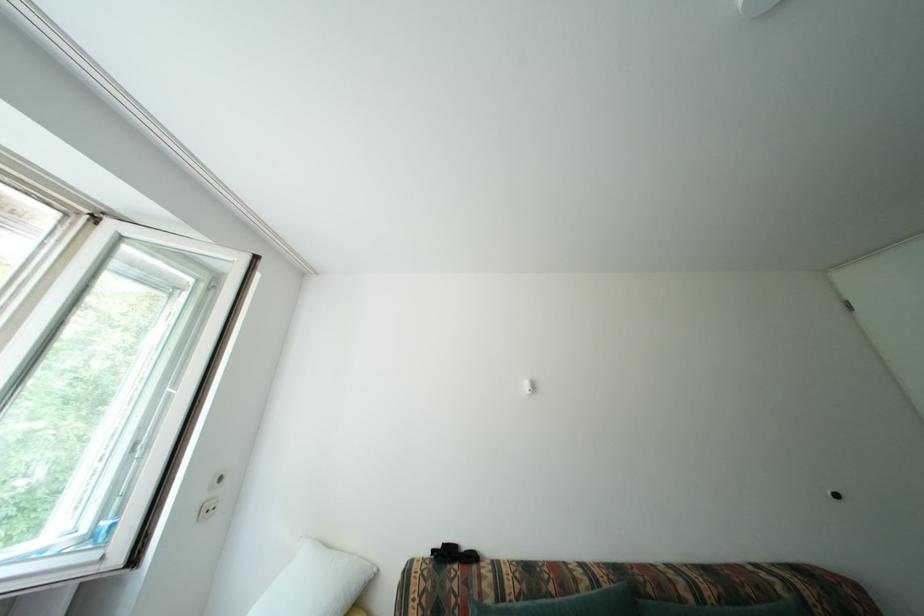
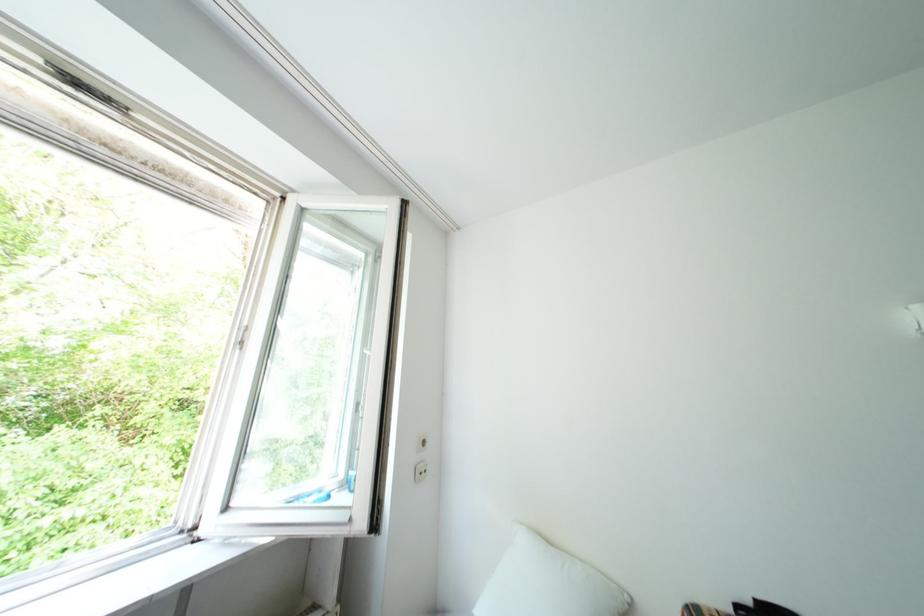
Question: How did the camera likely rotate?

Choices:
 (A) Left
 (B) Right
 (C) Up
 (D) Down

Answer: (A)